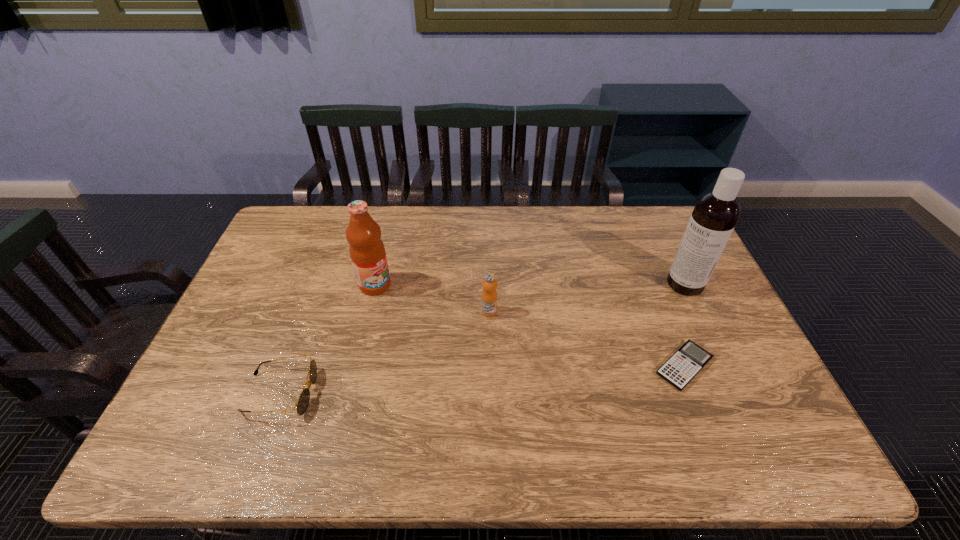
Where is `free space on the desktop that is between the leftmost object and the calculator and is positioned on the label side of the tallest object`? The height and width of the screenshot is (540, 960). free space on the desktop that is between the leftmost object and the calculator and is positioned on the label side of the tallest object is located at coordinates click(539, 376).

Identify the location of free space on the desktop that is between the fourth tallest object and the calculator and is positioned on the front label of the orange juice. The height and width of the screenshot is (540, 960). (533, 376).

Locate an element on the screen. vacant space on the desktop that is between the sunglasses and the calculator and is positioned on the front label of the fruit juice is located at coordinates (491, 379).